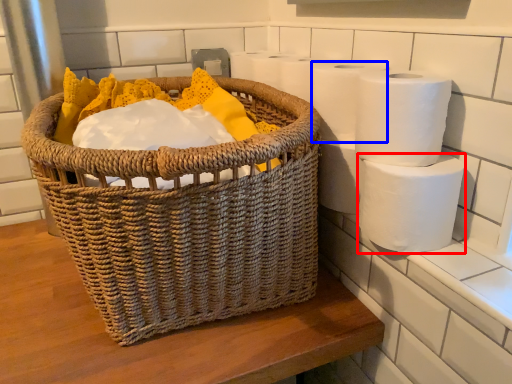
Question: Which object is closer to the camera taking this photo, toilet paper (highlighted by a red box) or toilet paper (highlighted by a blue box)?

Choices:
 (A) toilet paper
 (B) toilet paper

Answer: (A)